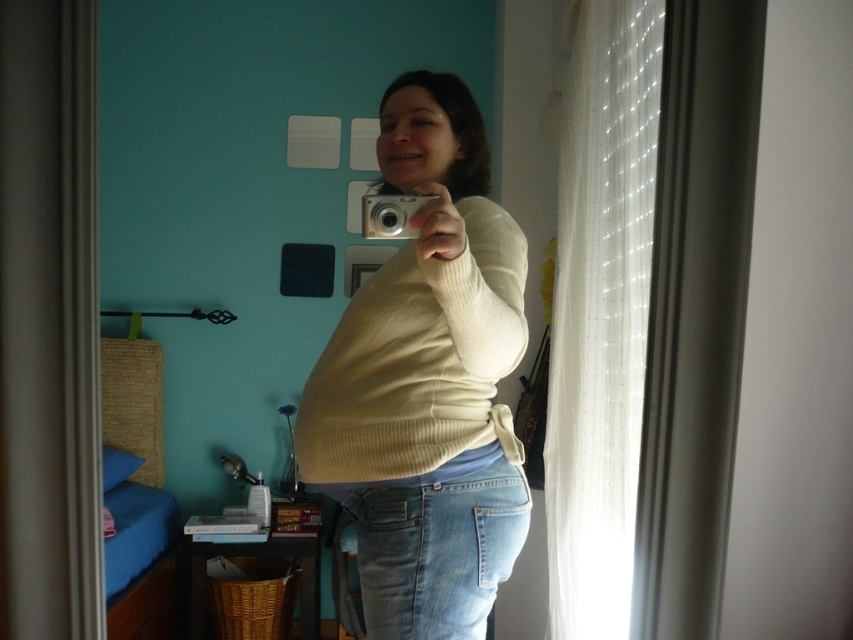
Does white ribbed sweater at center have a lesser height compared to light blue denim jeans at lower center?

No.

Consider the image. Between white ribbed sweater at center and light blue denim jeans at lower center, which one appears on the right side from the viewer's perspective?

light blue denim jeans at lower center

Is point (474, 561) positioned behind point (438, 508)?

That is False.

Locate an element on the screen. The width and height of the screenshot is (853, 640). white ribbed sweater at center is located at coordinates tap(427, 381).

Does white sheer curtain at right come behind light blue denim jeans at lower center?

Yes, it is behind light blue denim jeans at lower center.

This screenshot has width=853, height=640. Describe the element at coordinates (601, 314) in the screenshot. I see `white sheer curtain at right` at that location.

Describe the element at coordinates (601, 314) in the screenshot. I see `white sheer curtain at right` at that location.

Identify the location of white sheer curtain at right. (601, 314).

Who is shorter, light blue denim jeans at lower center or silver metallic camera at center?

Standing shorter between the two is silver metallic camera at center.

At what (x,y) coordinates should I click in order to perform the action: click on light blue denim jeans at lower center. Please return your answer as a coordinate pair (x, y). Looking at the image, I should click on (433, 552).

Locate an element on the screen. light blue denim jeans at lower center is located at coordinates (433, 552).